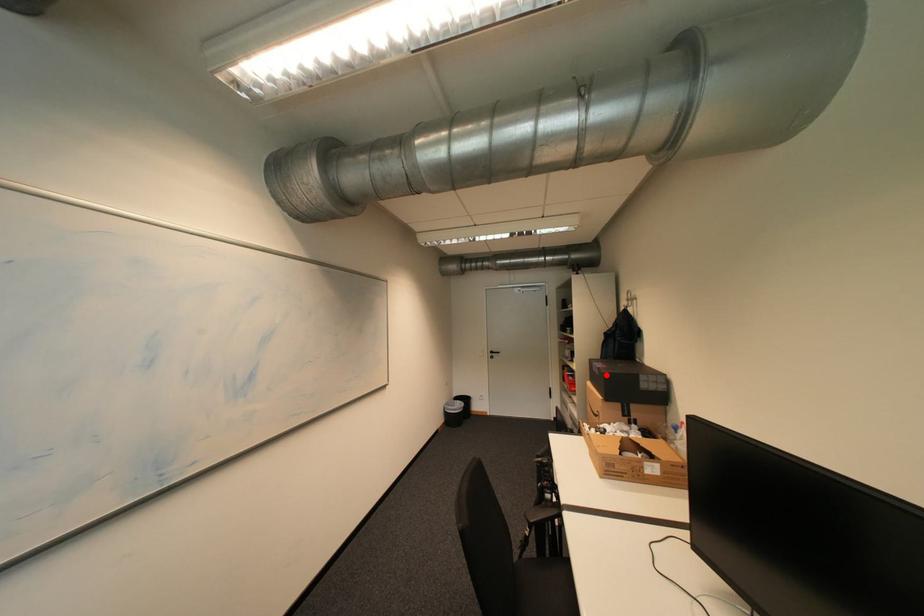
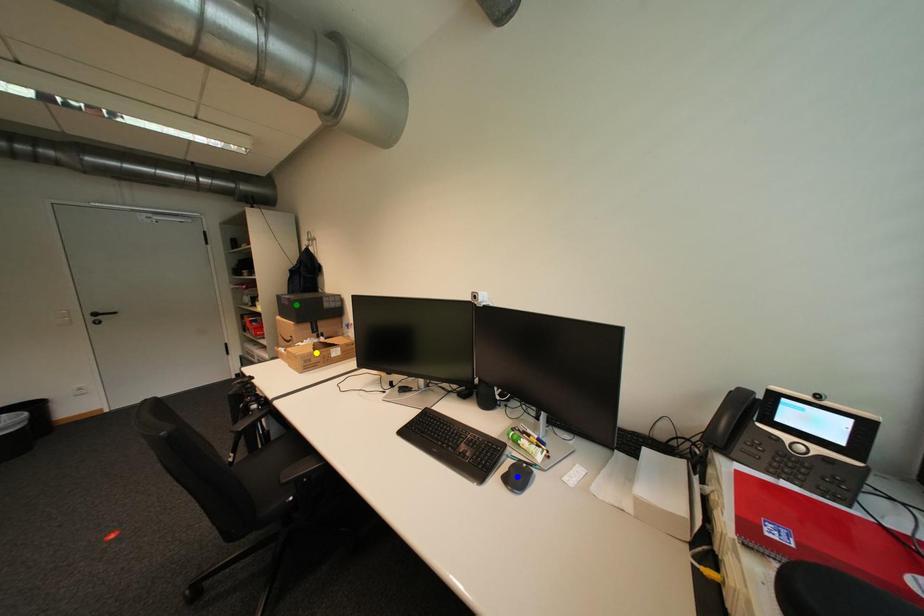
Question: I am providing you with two images of the same scene from different viewpoints. A red point is marked on the first image. You are given multiple points on the second image. Which point in image 2 represents the same 3d spot as the red point in image 1?

Choices:
 (A) green point
 (B) yellow point
 (C) blue point

Answer: (A)